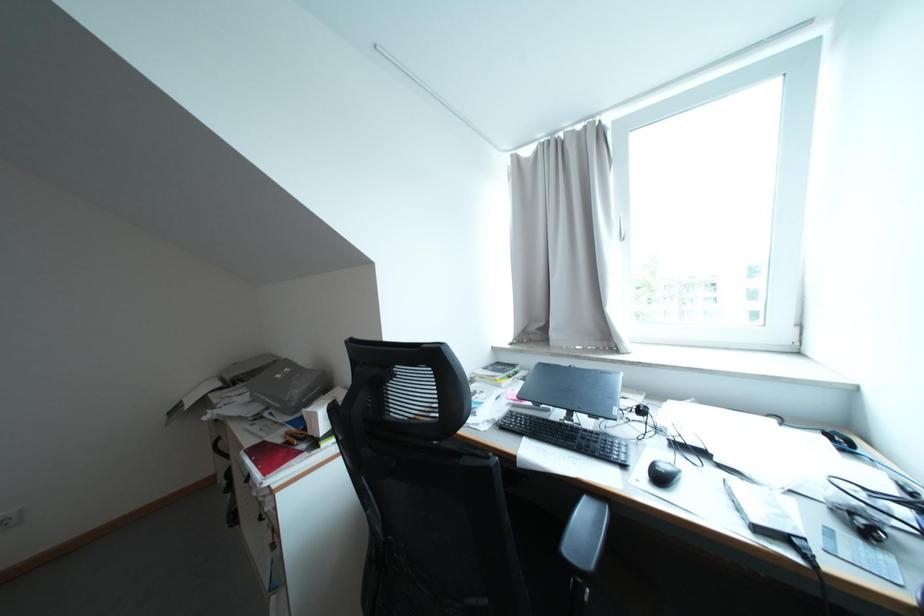
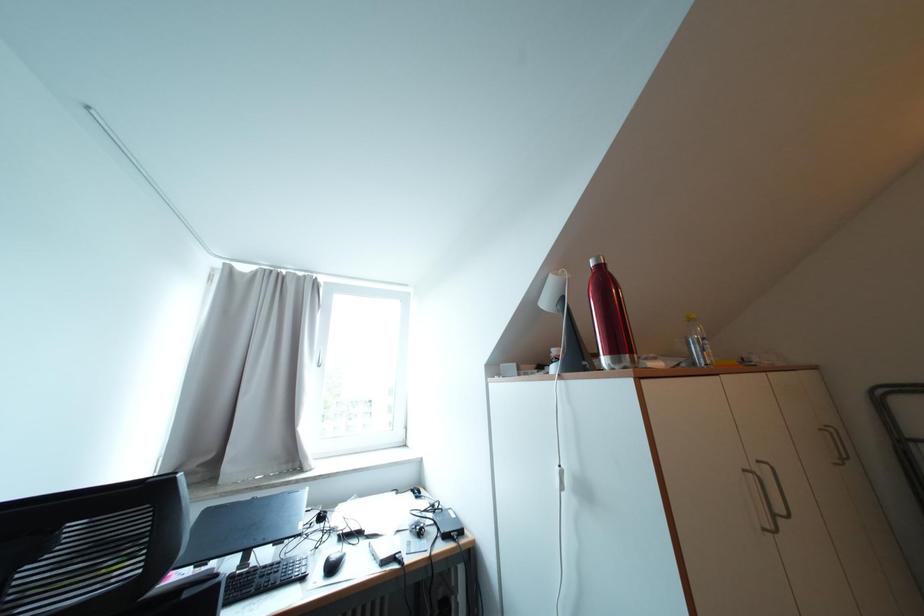
Based on the continuous images, in which direction is the camera rotating?

The camera rotated toward right-up.